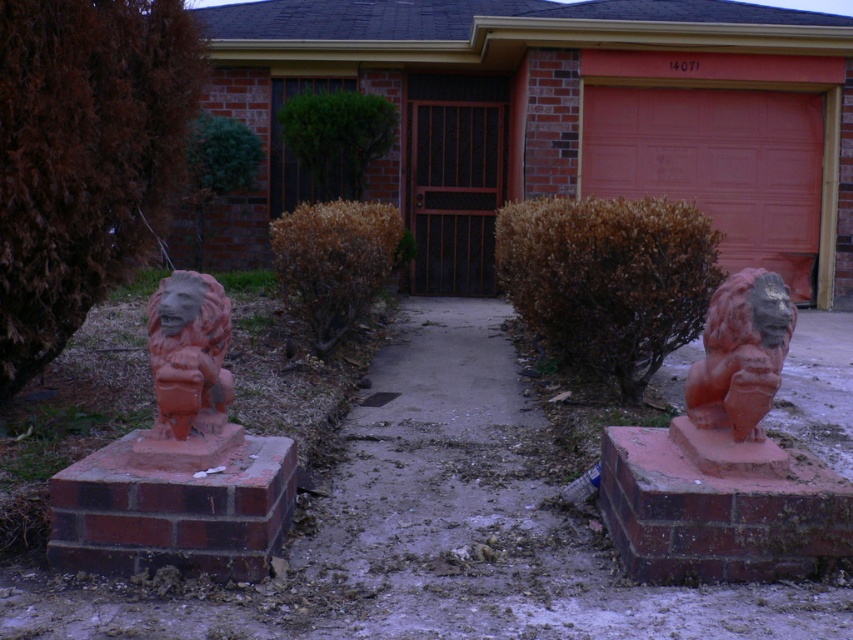
You are a delivery person trying to locate the correct house. You see a house with a brick facade and a garage door. The address is 14071. You are standing at point A, which is at coordinates [717,164]. Can you confirm if the garage door at this point is the correct one for address 14071?

Yes, the garage door at point A is the correct one for address 14071 because the description states that at point [717,164] lies the matte red garage door at center, which matches the address provided.

You are a delivery person trying to place a package between the terracotta statue at right and the matte terracotta lion at left. Can you fit the package in between them if the package requires a 1.2 meter gap? Please explain your reasoning based on the spatial arrangement.

The terracotta statue at right is in front of the matte terracotta lion at left, meaning there is a gap between them. However, the exact distance isn not provided in the description. Without knowing the actual space between the two statues, it is impossible to determine if the 1.2 meter gap requirement is met.

You are a delivery person trying to find the correct address. You see the terracotta statue at right and the matte terracotta lion at left. Which one is on the right side of the other?

The terracotta statue at right is positioned on the right side of matte terracotta lion at left.